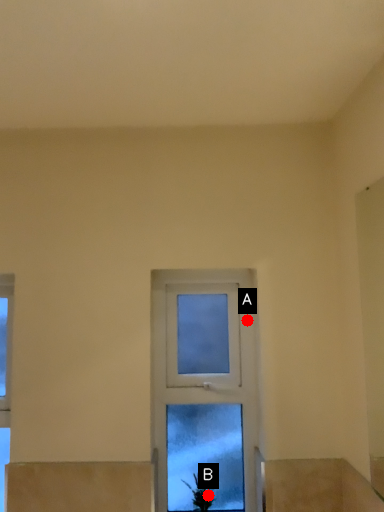
Question: Two points are circled on the image, labeled by A and B beside each circle. Among these points, which one is nearest to the camera?

Choices:
 (A) A is closer
 (B) B is closer

Answer: (B)